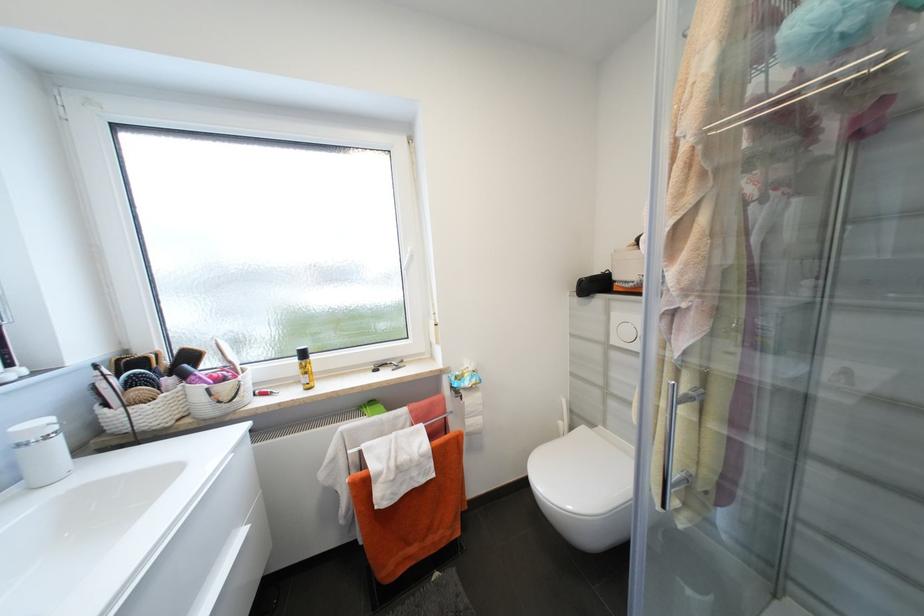
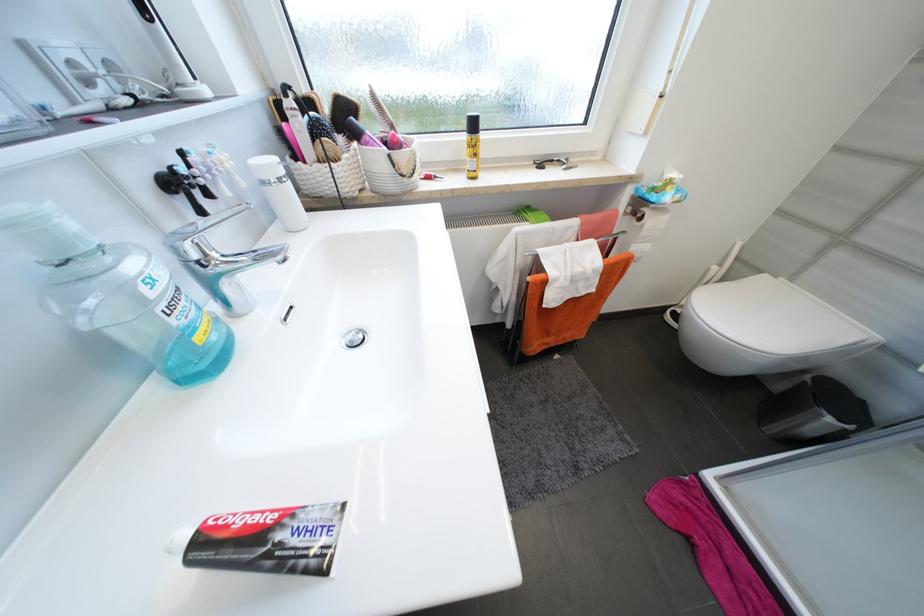
In the second image, find the point that corresponds to the point at 190,377 in the first image.

(362, 136)